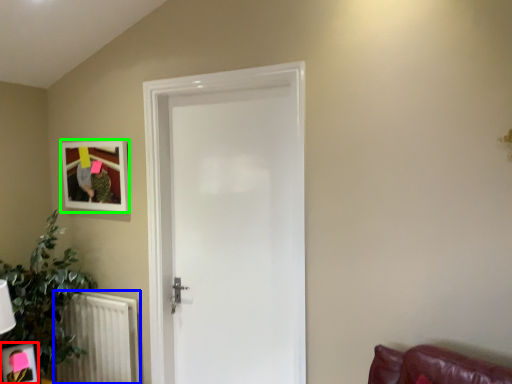
Question: Which object is positioned farthest from picture frame (highlighted by a red box)? Select from radiator (highlighted by a blue box) and picture frame (highlighted by a green box).

Choices:
 (A) radiator
 (B) picture frame

Answer: (B)